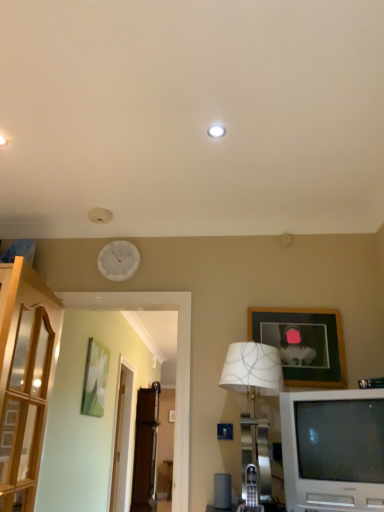
Question: From the image's perspective, is white glossy clock at upper center located beneath green matte painting at left, placed as the 2th picture frame when sorted from top to bottom?

Choices:
 (A) no
 (B) yes

Answer: (A)

Question: From a real-world perspective, does white glossy clock at upper center sit lower than green matte painting at left, acting as the second picture frame starting from the right?

Choices:
 (A) no
 (B) yes

Answer: (A)

Question: Is white glossy clock at upper center located outside green matte painting at left, placed as the 2th picture frame when sorted from top to bottom?

Choices:
 (A) yes
 (B) no

Answer: (A)

Question: Considering the relative sizes of white glossy clock at upper center and green matte painting at left, positioned as the first picture frame in bottom-to-top order, in the image provided, is white glossy clock at upper center shorter than green matte painting at left, positioned as the first picture frame in bottom-to-top order,?

Choices:
 (A) yes
 (B) no

Answer: (A)

Question: Is the surface of white glossy clock at upper center in direct contact with green matte painting at left, acting as the second picture frame starting from the right?

Choices:
 (A) no
 (B) yes

Answer: (A)

Question: In terms of height, does white plastic television at lower right look taller or shorter compared to white glossy clock at upper center?

Choices:
 (A) short
 (B) tall

Answer: (B)

Question: In the image, is white plastic television at lower right on the left side or the right side of white glossy clock at upper center?

Choices:
 (A) left
 (B) right

Answer: (B)

Question: From the image's perspective, is white plastic television at lower right above or below white glossy clock at upper center?

Choices:
 (A) below
 (B) above

Answer: (A)

Question: From a real-world perspective, is white plastic television at lower right above or below white glossy clock at upper center?

Choices:
 (A) above
 (B) below

Answer: (B)

Question: From a real-world perspective, is transparent glass door at center, which is counted as the first glass door, starting from the back, physically located above or below green matte painting at left, placed as the 2th picture frame when sorted from top to bottom?

Choices:
 (A) below
 (B) above

Answer: (A)

Question: Is transparent glass door at center, the 2th glass door from the front, situated inside green matte painting at left, positioned as the first picture frame in bottom-to-top order, or outside?

Choices:
 (A) outside
 (B) inside

Answer: (A)

Question: In the image, is transparent glass door at center, the first glass door when ordered from bottom to top, positioned in front of or behind green matte painting at left, positioned as the 2th picture frame in front-to-back order?

Choices:
 (A) behind
 (B) front

Answer: (A)

Question: Is transparent glass door at center, which is counted as the first glass door, starting from the back, bigger or smaller than green matte painting at left, positioned as the first picture frame in bottom-to-top order?

Choices:
 (A) big
 (B) small

Answer: (A)

Question: Choose the correct answer: Is white fabric lampshade at lower right inside wooden picture frame at upper right, positioned as the 2th picture frame in bottom-to-top order, or outside it?

Choices:
 (A) inside
 (B) outside

Answer: (B)

Question: From a real-world perspective, is white fabric lampshade at lower right above or below wooden picture frame at upper right, the first picture frame viewed from the right?

Choices:
 (A) above
 (B) below

Answer: (B)